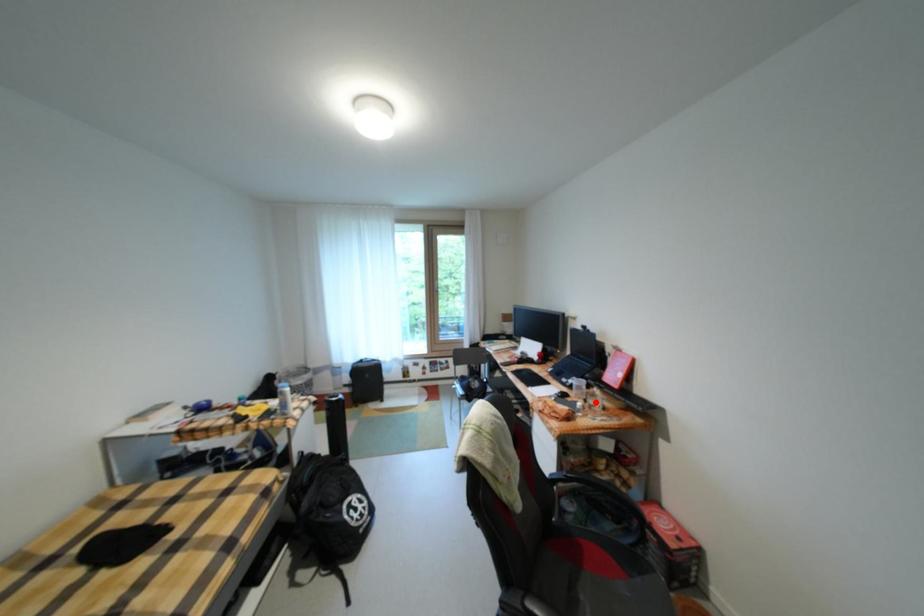
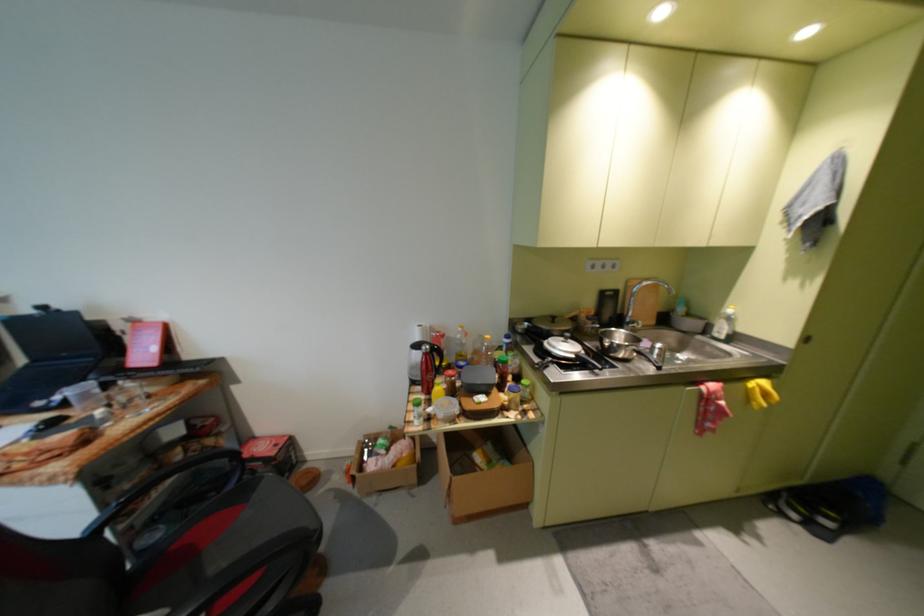
Locate, in the second image, the point that corresponds to the highlighted location in the first image.

(119, 407)